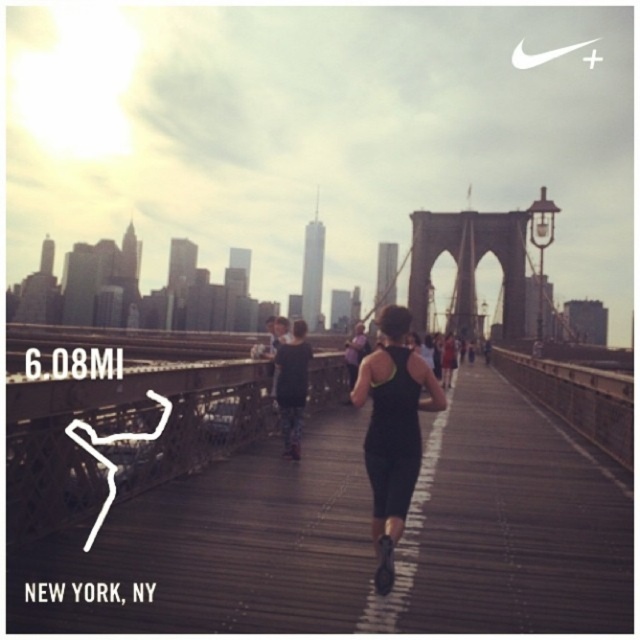
Does black matte running suit at center appear over dark gray stone bridge at center?

Incorrect, black matte running suit at center is not positioned above dark gray stone bridge at center.

Is black matte running suit at center positioned behind dark gray stone bridge at center?

No, black matte running suit at center is closer to the viewer.

Who is more distant from viewer, (381, 419) or (502, 220)?

Point (502, 220)

The height and width of the screenshot is (640, 640). What are the coordinates of `black matte running suit at center` in the screenshot? It's located at (392, 432).

Is dark gray stone bridge at center positioned in front of floral leggings at center?

No, it is behind floral leggings at center.

Does dark gray stone bridge at center appear over floral leggings at center?

Correct, dark gray stone bridge at center is located above floral leggings at center.

Is point (429, 212) farther from camera compared to point (285, 442)?

Yes, point (429, 212) is farther from viewer.

Identify the location of dark gray stone bridge at center. The width and height of the screenshot is (640, 640). (468, 262).

How far apart are black fabric running suit at center and dark gray stone bridge at center?

black fabric running suit at center is 137.92 meters from dark gray stone bridge at center.

Is black fabric running suit at center to the right of dark gray stone bridge at center from the viewer's perspective?

No, black fabric running suit at center is not to the right of dark gray stone bridge at center.

Is point (516, 556) positioned before point (426, 234)?

Yes, point (516, 556) is in front of point (426, 234).

Find the location of a particular element. black fabric running suit at center is located at coordinates (358, 538).